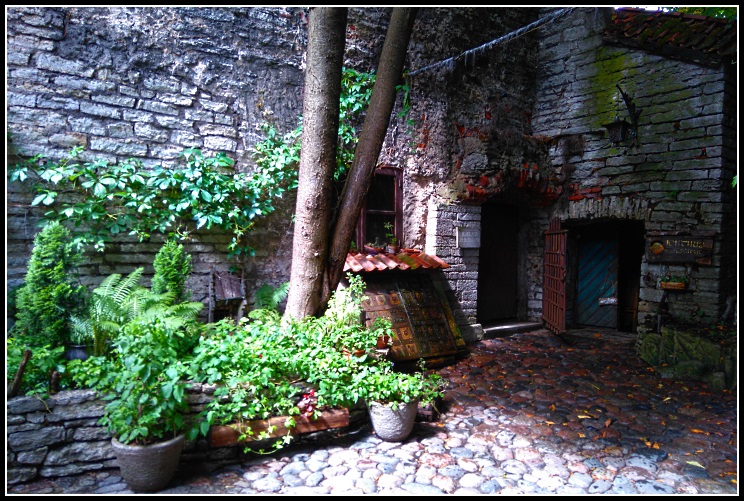
Where is `2 flower pots`? 2 flower pots is located at coordinates (150, 452), (402, 427).